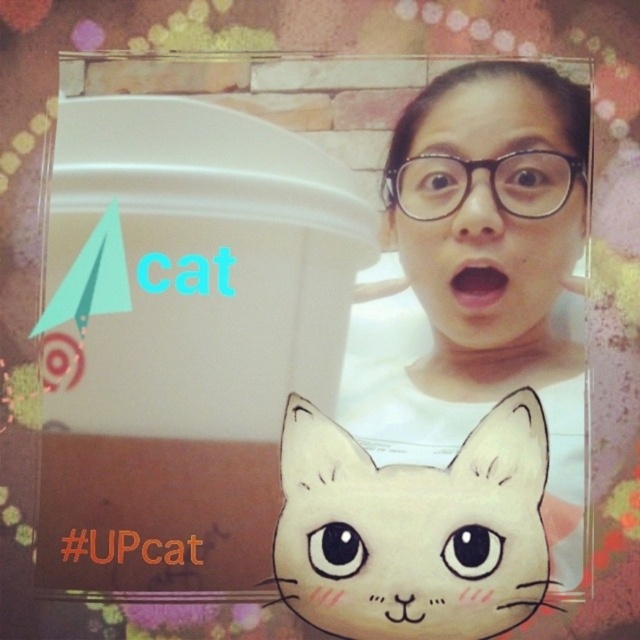
You are an interior designer working on a living room project. You have two matte objects to place on the wall in the scene described. The matte white cat face at center and the matte plastic face at upper center. Which object will you choose to place higher up on the wall to maintain visual balance?

The matte white cat face at center is larger in size compared to the matte plastic face at upper center. To maintain visual balance, the larger matte white cat face at center should be placed lower on the wall, while the smaller matte plastic face at upper center can be placed higher up.

You are standing 30 inches away from the brick wall in the image. Is the point at coordinate (513, 177) closer to you than the brick wall?

The distance of point (513, 177) from viewer is 28.71 inches, which is less than 30 inches. Therefore, the point at coordinate (513, 177) is closer to you than the brick wall.

You are an art curator examining a digital artwork that combines a human subject and a stylized cat graphic. The artwork includes a white matte face at center and a matte white cat face at center. From the viewer perspective, which object is positioned to the left?

The matte white cat face at center is positioned to the left of the white matte face at center.